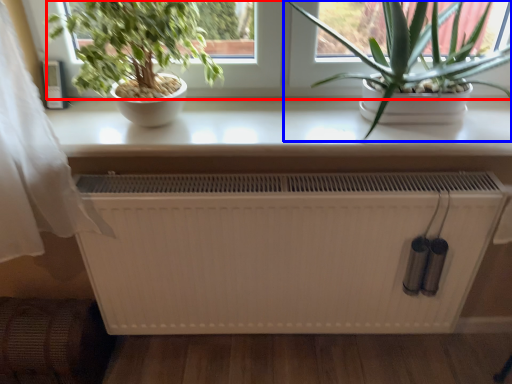
Question: Which of the following is the closest to the observer, window screen (highlighted by a red box) or houseplant (highlighted by a blue box)?

Choices:
 (A) window screen
 (B) houseplant

Answer: (B)